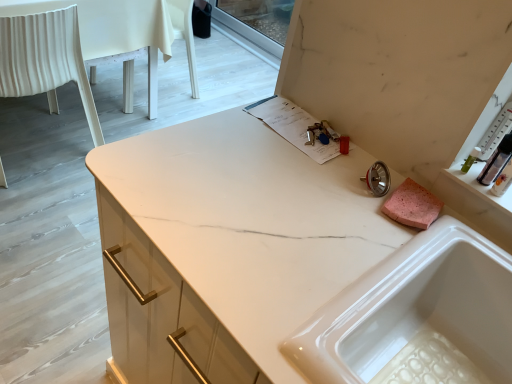
Question: From a real-world perspective, is white glossy sink at upper right above or below white fabric chair at left?

Choices:
 (A) above
 (B) below

Answer: (A)

Question: From the image's perspective, is white glossy sink at upper right positioned above or below white fabric chair at left?

Choices:
 (A) above
 (B) below

Answer: (B)

Question: Estimate the real-world distances between objects in this image. Which object is farther from the white glossy sink at upper right?

Choices:
 (A) clear plastic bottle at upper right
 (B) white fabric chair at left
 (C) white marble countertop at center

Answer: (B)

Question: Considering the real-world distances, which object is closest to the clear plastic bottle at upper right?

Choices:
 (A) white glossy sink at upper right
 (B) white marble countertop at center
 (C) white fabric chair at left

Answer: (A)